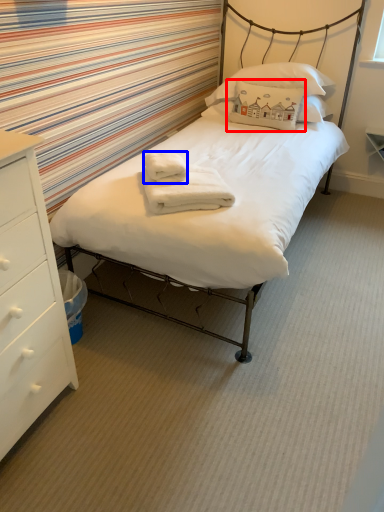
Question: Which object is closer to the camera taking this photo, pillow (highlighted by a red box) or bath towel (highlighted by a blue box)?

Choices:
 (A) pillow
 (B) bath towel

Answer: (B)